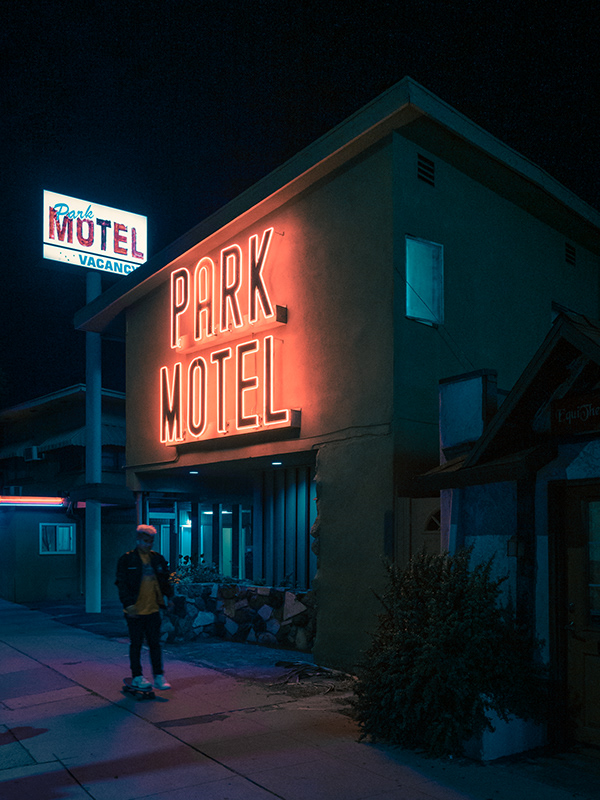
Identify the location of neon lights. (185, 302), (169, 410), (217, 426), (238, 421), (277, 412), (262, 286), (231, 301), (206, 304), (191, 433).